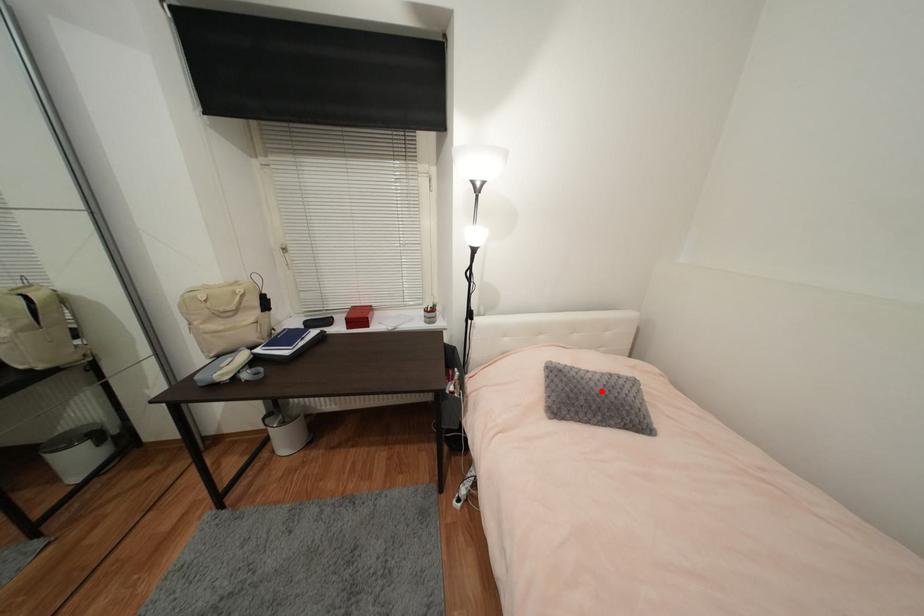
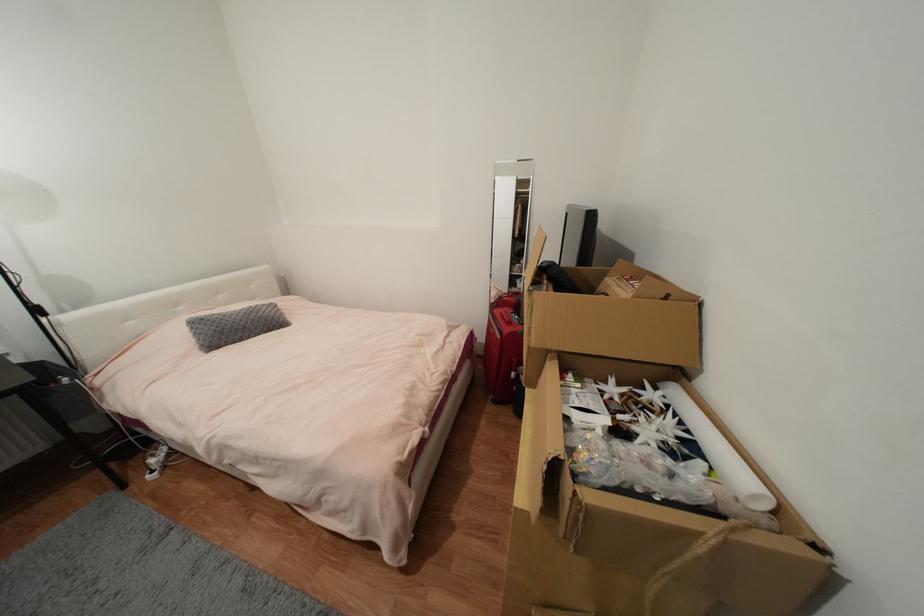
Question: A red point is marked in image1. In image2, is the corresponding 3D point closer to the camera or farther? Reply with the corresponding letter.

Choices:
 (A) The corresponding 3D point is closer.
 (B) The corresponding 3D point is farther.

Answer: (A)